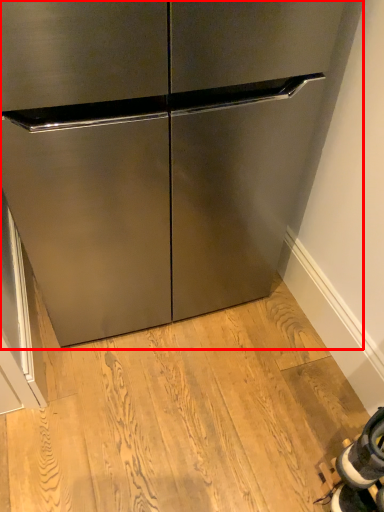
Question: From the image, what is the correct spatial relationship of cabinetry (annotated by the red box) in relation to shoe?

Choices:
 (A) right
 (B) left

Answer: (B)